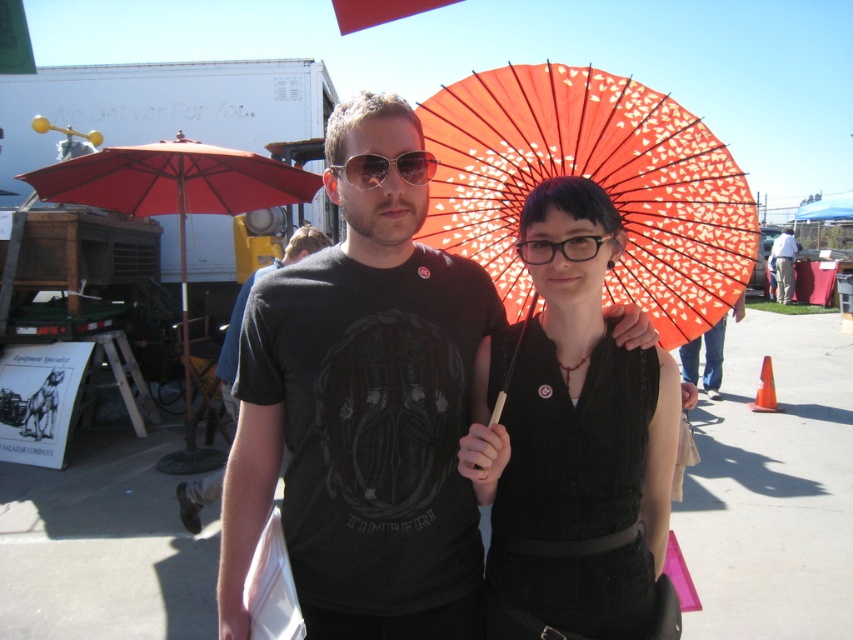
Question: Is matte black dress at center above orange paper parasol at center?

Choices:
 (A) yes
 (B) no

Answer: (B)

Question: Can you confirm if red fabric umbrella at left is positioned to the left of metal aviator goggles at center?

Choices:
 (A) yes
 (B) no

Answer: (A)

Question: Among these objects, which one is nearest to the camera?

Choices:
 (A) metal aviator goggles at center
 (B) matte black umbrella at center

Answer: (A)

Question: Considering the real-world distances, which object is closest to the orange paper parasol at center?

Choices:
 (A) matte black umbrella at center
 (B) dark gray t-shirt at center

Answer: (A)

Question: Which point is farther to the camera?

Choices:
 (A) matte black dress at center
 (B) metal aviator goggles at center
 (C) orange paper parasol at center

Answer: (C)

Question: Is black matte t-shirt at center above matte black glasses at center?

Choices:
 (A) yes
 (B) no

Answer: (B)